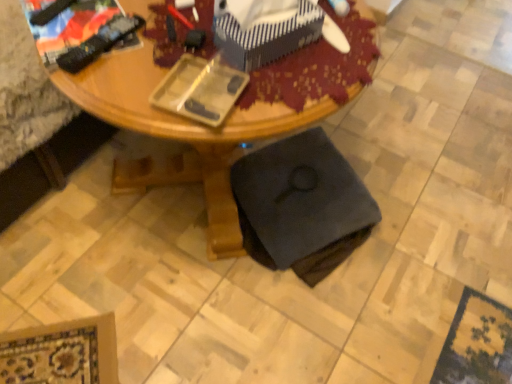
Identify the location of vacant area that is in front of blue striped fabric box at upper center. (283, 97).